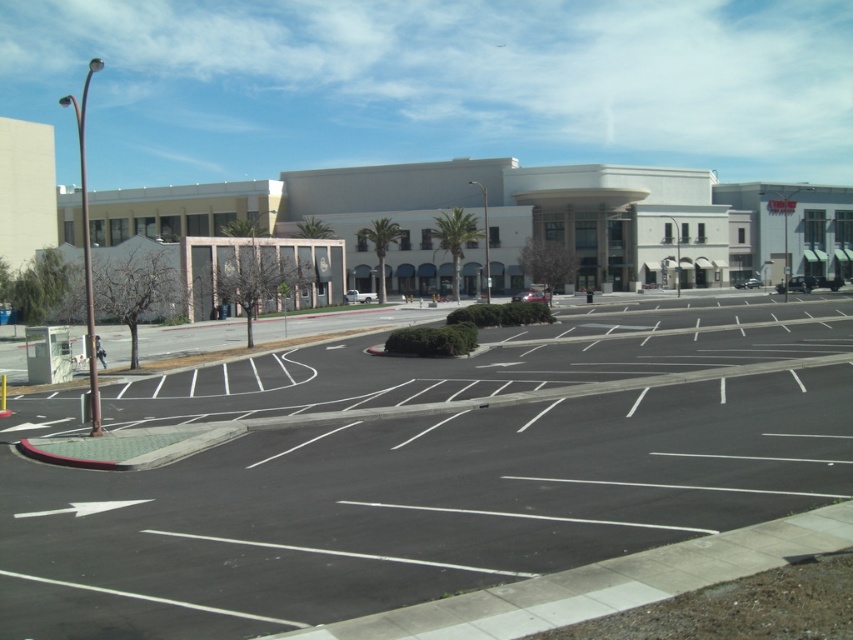
You are a delivery driver who needs to park your truck in the black asphalt parking lot at center. However, the parking space is only available on the right side of the white smooth building at center. Can you park there?

The black asphalt parking lot at center is positioned on the left side of the white smooth building at center, so the parking space on the right side of the white smooth building at center is not available. You cannot park there.

You are a delivery driver who needs to park your truck in the black asphalt parking lot at center and then walk to the white smooth building at center to deliver a package. If your walking speed is 1.5 meters per second, how many seconds will it take you to reach the building after parking?

The distance between the black asphalt parking lot at center and the white smooth building at center is 47.14 meters. At a walking speed of 1.5 meters per second, it will take approximately 31.43 seconds to reach the building after parking.

You are a delivery driver who needs to park your truck in the black asphalt parking lot at center. The truck requires a space larger than the white smooth building at center. Can you park there?

The black asphalt parking lot at center is smaller than the white smooth building at center. Therefore, the parking lot is not large enough to accommodate the truck that requires a space larger than the white smooth building at center.